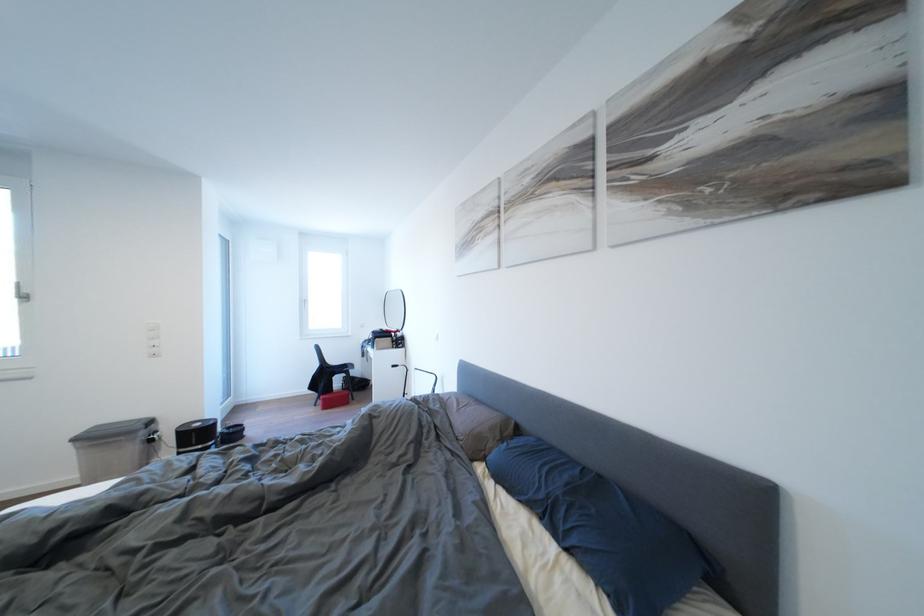
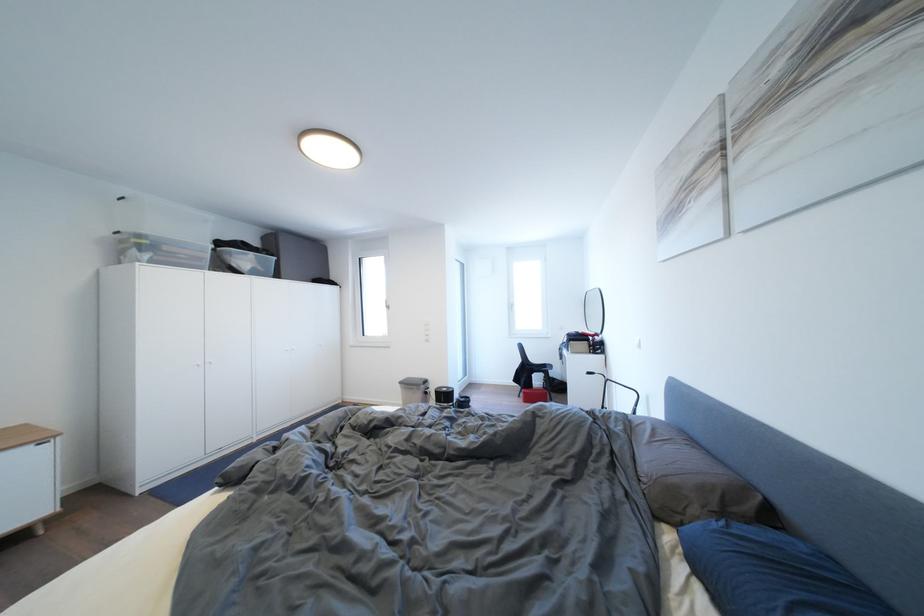
Question: The first image is from the beginning of the video and the second image is from the end. How did the camera likely rotate when shooting the video?

Choices:
 (A) Left
 (B) Right
 (C) Up
 (D) Down

Answer: (A)